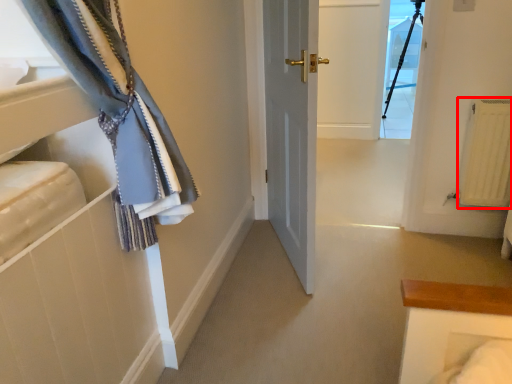
Question: From the image, what is the correct spatial relationship of radiator (annotated by the red box) in relation to glass door?

Choices:
 (A) left
 (B) right

Answer: (A)